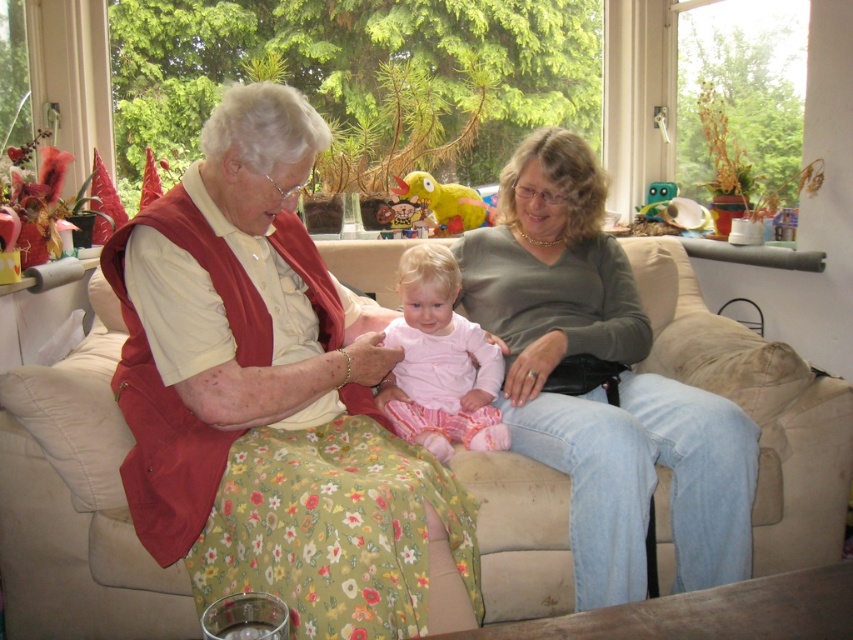
Question: Among these points, which one is farthest from the camera?

Choices:
 (A) (323, 352)
 (B) (527, 602)
 (C) (579, 608)
 (D) (454, 321)

Answer: (D)

Question: Does floral fabric dress at center have a smaller size compared to pink fabric baby at center?

Choices:
 (A) no
 (B) yes

Answer: (A)

Question: Is beige fabric couch at center to the right of matte green sweater at center from the viewer's perspective?

Choices:
 (A) yes
 (B) no

Answer: (A)

Question: Is floral fabric dress at center smaller than pink fabric baby at center?

Choices:
 (A) yes
 (B) no

Answer: (B)

Question: Based on their relative distances, which object is farther from the floral fabric dress at center?

Choices:
 (A) matte green sweater at center
 (B) pink fabric baby at center
 (C) beige fabric couch at center

Answer: (C)

Question: Which point is farther to the camera?

Choices:
 (A) (84, 481)
 (B) (627, 557)

Answer: (A)